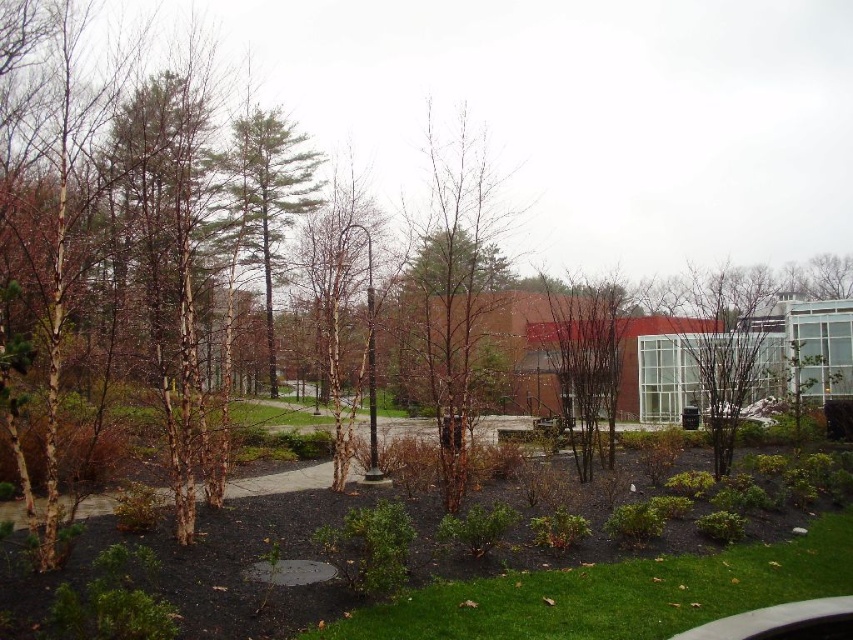
Is bare brown tree at center shorter than green textured pine tree at center?

Correct, bare brown tree at center is not as tall as green textured pine tree at center.

Can you confirm if bare brown tree at center is positioned to the right of green textured pine tree at center?

Yes, bare brown tree at center is to the right of green textured pine tree at center.

Is point (447, 221) farther from camera compared to point (245, 129)?

That is False.

Image resolution: width=853 pixels, height=640 pixels. Identify the location of bare brown tree at center. (454, 289).

Who is more distant from viewer, (483, 193) or (715, 413)?

The point (715, 413) is more distant.

Between bare brown tree at center and bare branches at right, which one is positioned higher?

Positioned higher is bare branches at right.

The width and height of the screenshot is (853, 640). I want to click on bare brown tree at center, so click(x=454, y=289).

Is point (749, 330) positioned in front of point (292, 189)?

Yes.

The image size is (853, 640). Find the location of `bare branches at right`. bare branches at right is located at coordinates (723, 342).

Is point (708, 346) positioned after point (277, 140)?

That is False.

At what (x,y) coordinates should I click in order to perform the action: click on bare branches at right. Please return your answer as a coordinate pair (x, y). The height and width of the screenshot is (640, 853). Looking at the image, I should click on (723, 342).